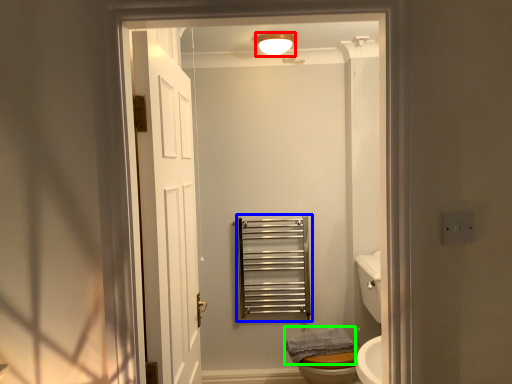
Question: Estimate the real-world distances between objects in this image. Which object is farther from light fixture (highlighted by a red box), balustrade (highlighted by a blue box) or bath towel (highlighted by a green box)?

Choices:
 (A) balustrade
 (B) bath towel

Answer: (B)